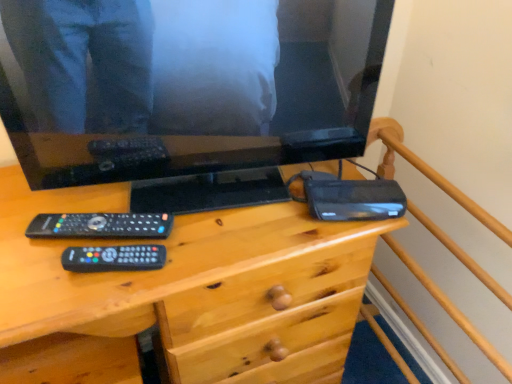
Where is `free point below black glossy television at upper center (from a real-world perspective)`? free point below black glossy television at upper center (from a real-world perspective) is located at coordinates (205, 168).